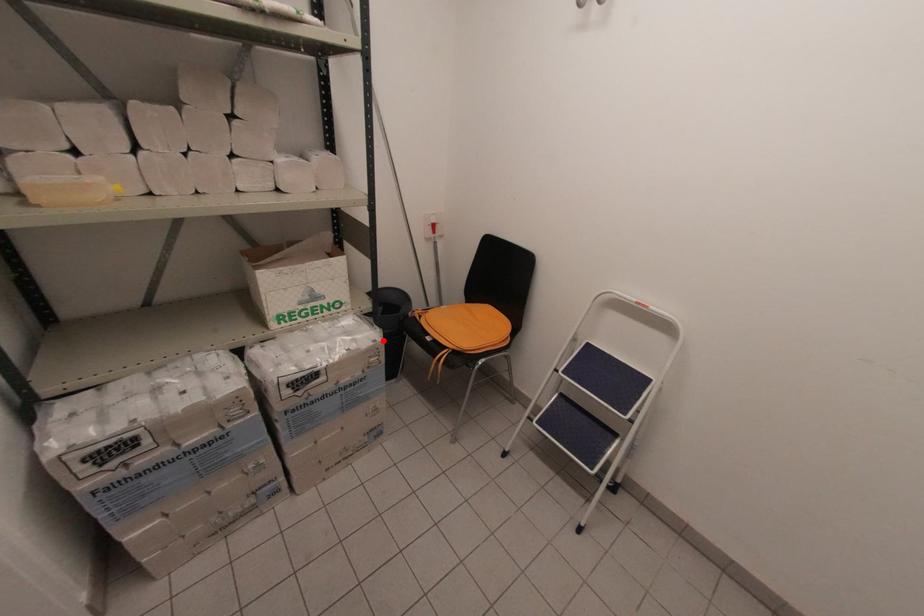
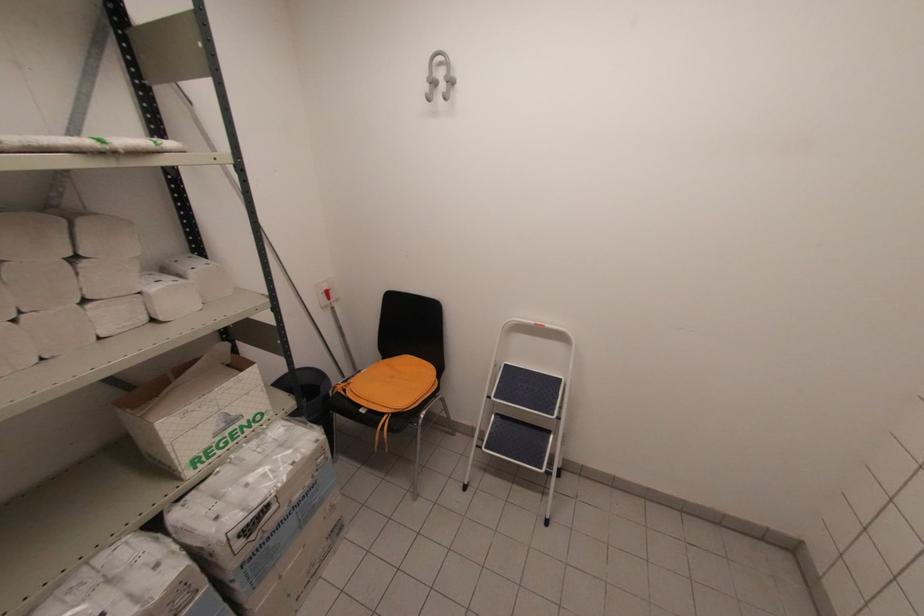
Find the pixel in the second image that matches the highlighted location in the first image.

(325, 437)